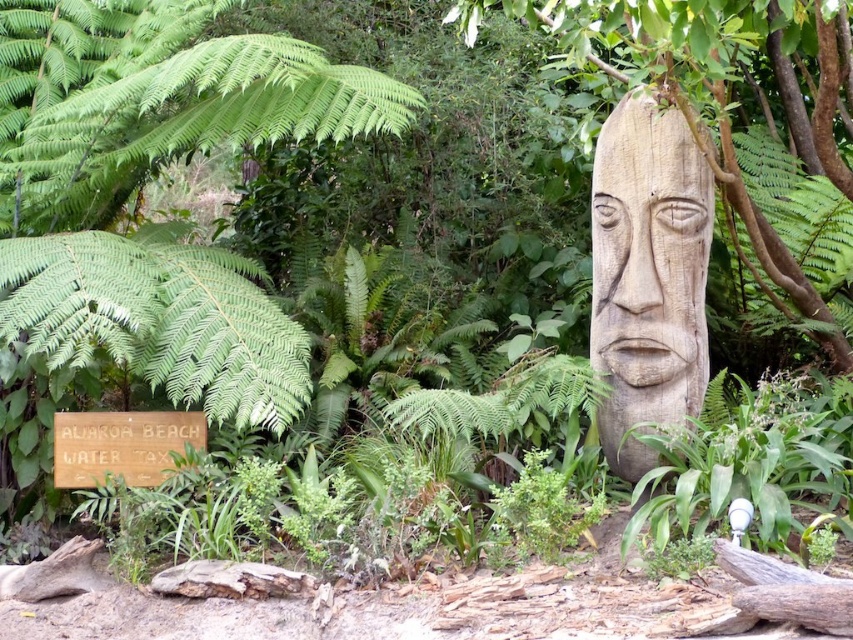
Question: Can you confirm if wooden carving at center is bigger than wooden sign at lower left?

Choices:
 (A) yes
 (B) no

Answer: (A)

Question: Can you confirm if wooden carving at center is bigger than wooden sign at lower left?

Choices:
 (A) no
 (B) yes

Answer: (B)

Question: Considering the relative positions of wooden carving at center and wooden sign at lower left in the image provided, where is wooden carving at center located with respect to wooden sign at lower left?

Choices:
 (A) above
 (B) below

Answer: (A)

Question: Which of the following is the farthest from the observer?

Choices:
 (A) (146, 417)
 (B) (660, 371)

Answer: (A)

Question: Among these points, which one is farthest from the camera?

Choices:
 (A) (160, 445)
 (B) (633, 225)

Answer: (A)